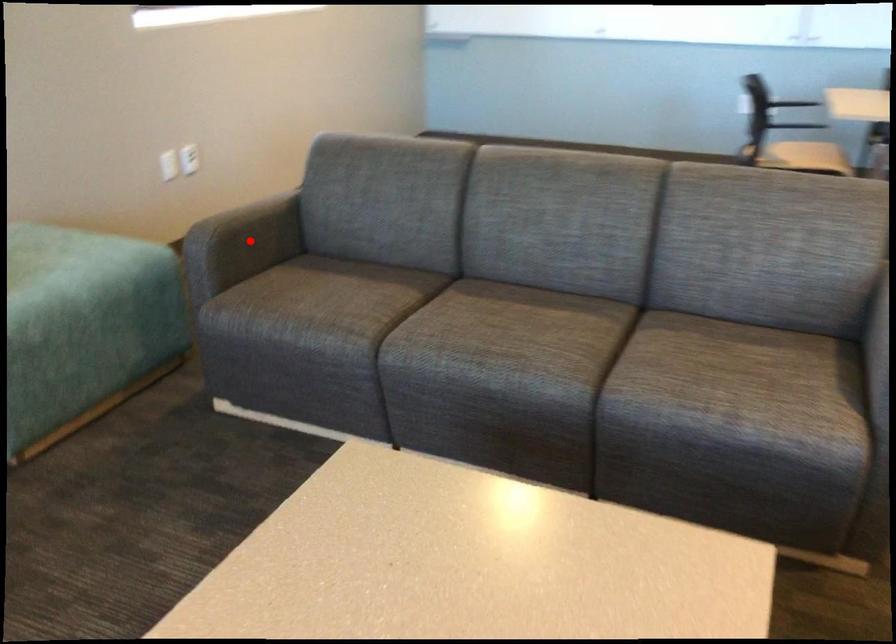
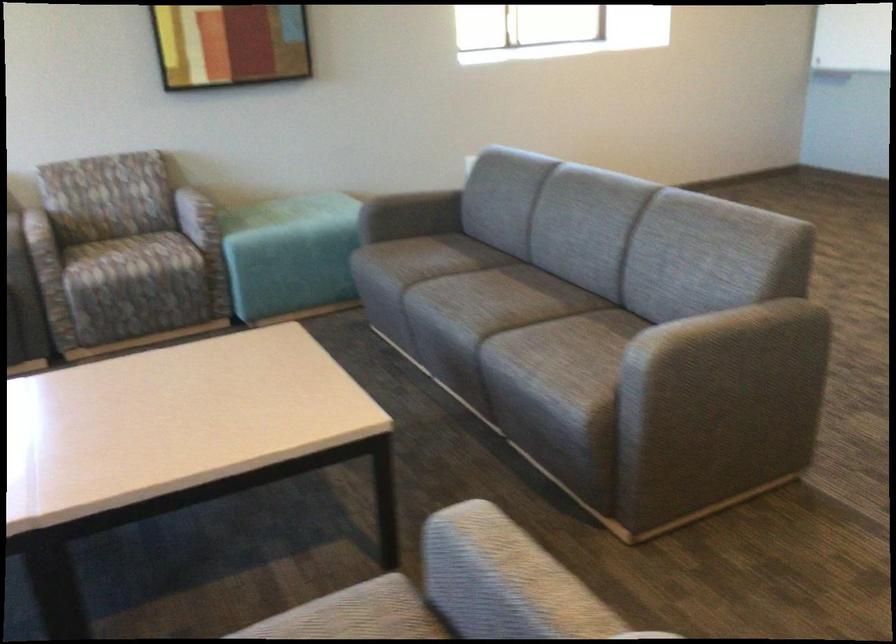
Find the pixel in the second image that matches the highlighted location in the first image.

(411, 213)